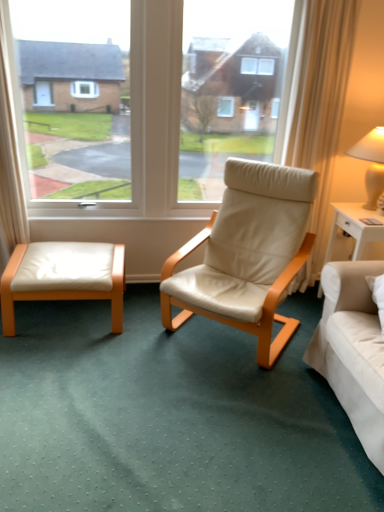
What are the coordinates of `vacant area situated below white leather ottoman at lower left (from a real-world perspective)` in the screenshot? It's located at (70, 315).